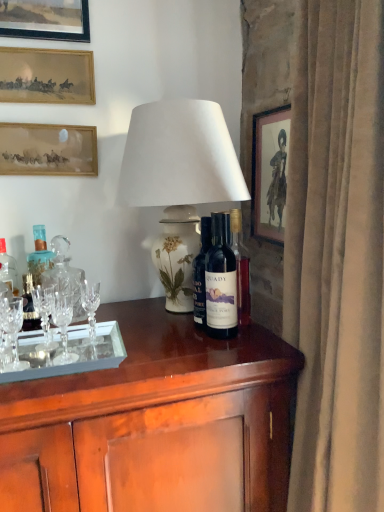
At what (x,y) coordinates should I click in order to perform the action: click on vacant area located to the right-hand side of dark blue glass bottle at center, which appears as the 1th bottle when viewed from the right. Please return your answer as a coordinate pair (x, y). This screenshot has height=512, width=384. Looking at the image, I should click on (266, 346).